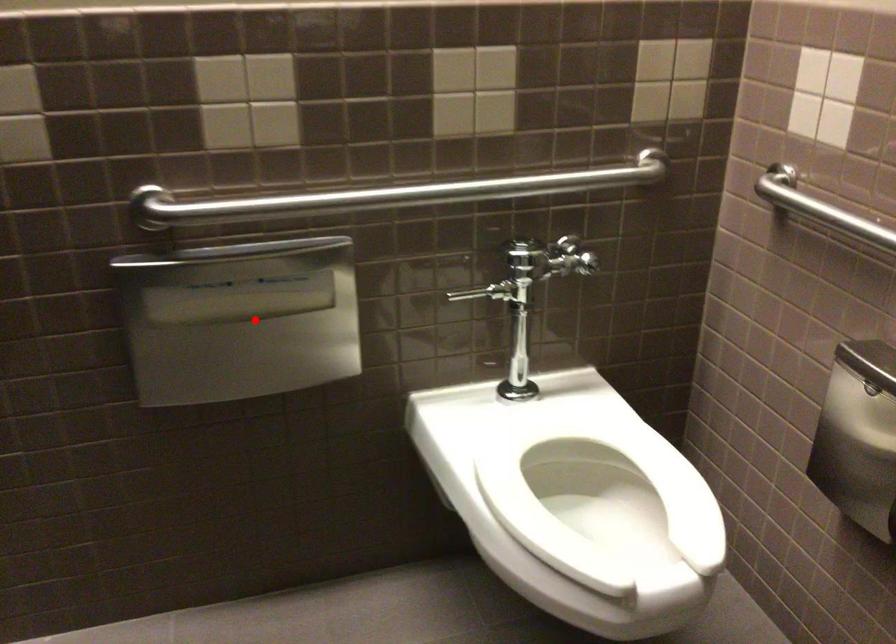
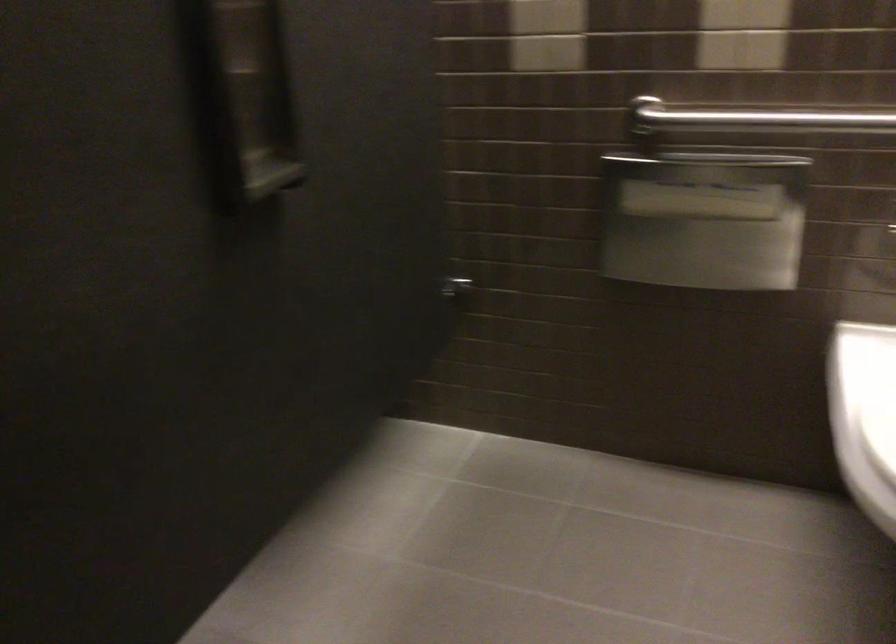
Locate, in the second image, the point that corresponds to the highlighted location in the first image.

(703, 220)